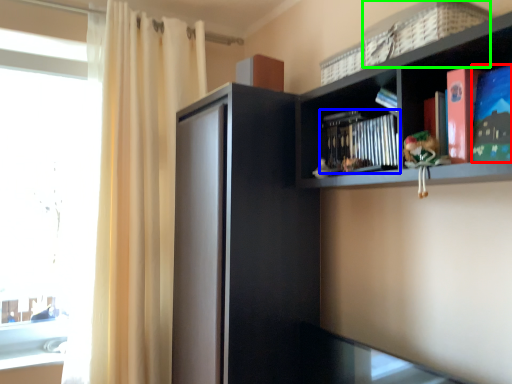
Question: Estimate the real-world distances between objects in this image. Which object is closer to paperback book (highlighted by a red box), book (highlighted by a blue box) or basket (highlighted by a green box)?

Choices:
 (A) book
 (B) basket

Answer: (B)